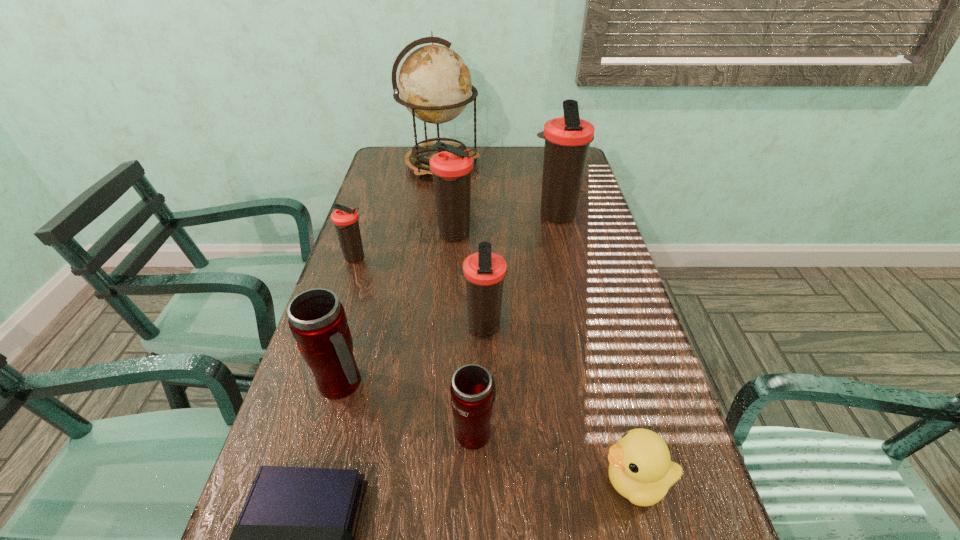
Locate an element on the screen. The height and width of the screenshot is (540, 960). thermos bottle positioned at the right edge is located at coordinates (567, 139).

In order to click on duck at the right edge in this screenshot , I will do `click(641, 470)`.

Where is `object that is at the far left corner`? object that is at the far left corner is located at coordinates (434, 83).

The height and width of the screenshot is (540, 960). Find the location of `vacant position at the far edge of the desktop`. vacant position at the far edge of the desktop is located at coordinates (476, 171).

Where is `vacant space at the left edge of the desktop`? The width and height of the screenshot is (960, 540). vacant space at the left edge of the desktop is located at coordinates (304, 464).

Locate an element on the screen. free space at the right edge of the desktop is located at coordinates (614, 380).

At what (x,y) coordinates should I click in order to perform the action: click on free space at the far left corner of the desktop. Please return your answer as a coordinate pair (x, y). The width and height of the screenshot is (960, 540). Looking at the image, I should click on (379, 160).

At what (x,y) coordinates should I click in order to perform the action: click on empty space between the fifth farthest thermos bottle and the second smallest brown thermos bottle. Please return your answer as a coordinate pair (x, y). Looking at the image, I should click on (412, 355).

The image size is (960, 540). Find the location of `vacant area between the seventh farthest object and the third tallest object`. vacant area between the seventh farthest object and the third tallest object is located at coordinates (465, 333).

Locate an element on the screen. blank region between the duck and the smallest brown thermos bottle is located at coordinates (495, 370).